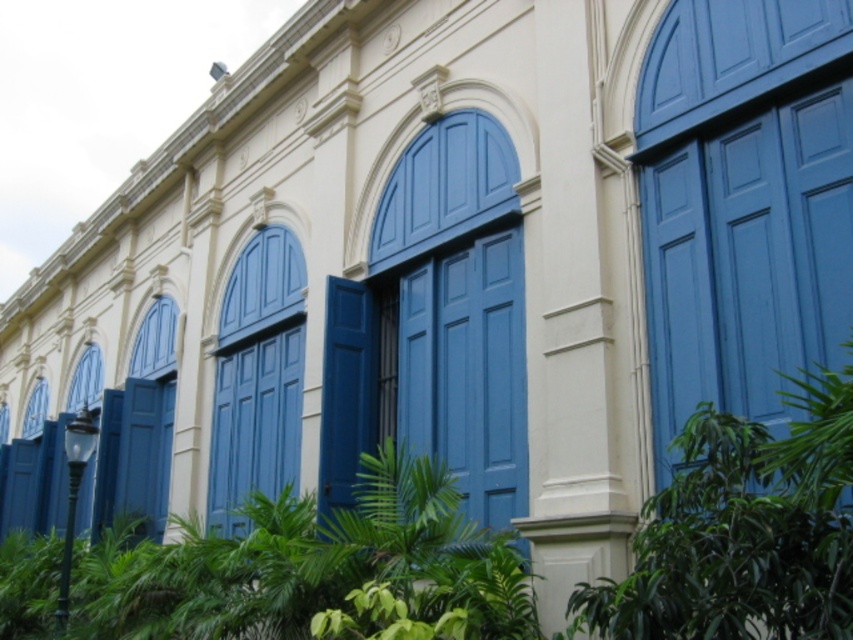
Who is higher up, green leafy plant at center or matte blue door at center?

matte blue door at center is above.

Can you confirm if green leafy plant at center is positioned above matte blue door at center?

Incorrect, green leafy plant at center is not positioned above matte blue door at center.

Is point (656, 586) positioned in front of point (229, 353)?

Yes.

I want to click on green leafy plant at center, so click(741, 531).

Which is more to the left, green leafy plant at lower center or matte blue door at center?

Positioned to the left is green leafy plant at lower center.

Who is more forward, (492, 568) or (263, 403)?

Point (492, 568) is more forward.

You are a GUI agent. You are given a task and a screenshot of the screen. Output one action in this format:
    pyautogui.click(x=<x>, y=<y>)
    Task: Click on the green leafy plant at lower center
    This screenshot has height=640, width=853.
    Given the screenshot: What is the action you would take?
    pyautogui.click(x=314, y=570)

How much distance is there between clear glass window at upper left and matte blue window at lower left?

The distance of clear glass window at upper left from matte blue window at lower left is 16.12 feet.

Does point (85, 365) come farther from viewer compared to point (28, 422)?

That is False.

Who is more forward, (84, 369) or (36, 417)?

Point (84, 369)

This screenshot has width=853, height=640. In order to click on clear glass window at upper left in this screenshot , I will do `click(85, 380)`.